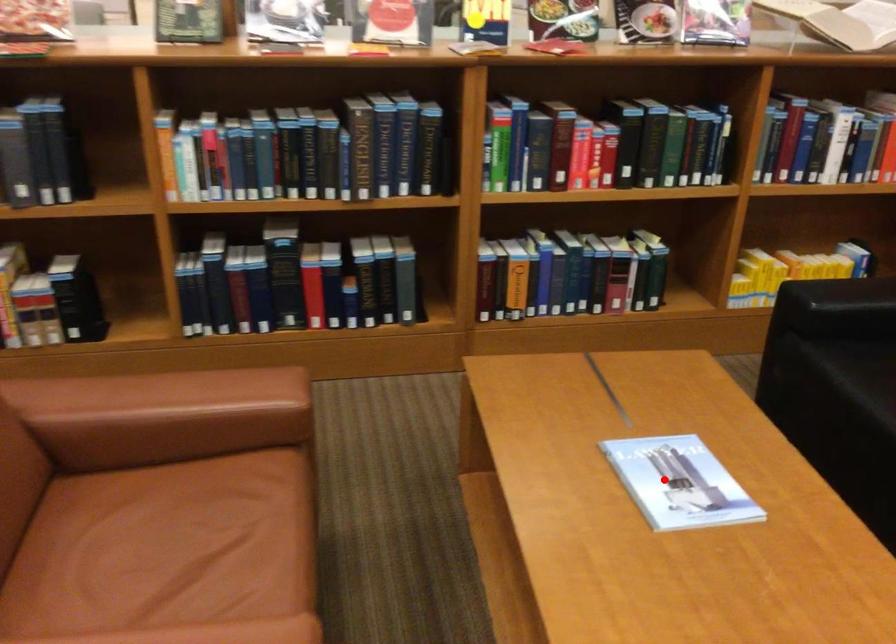
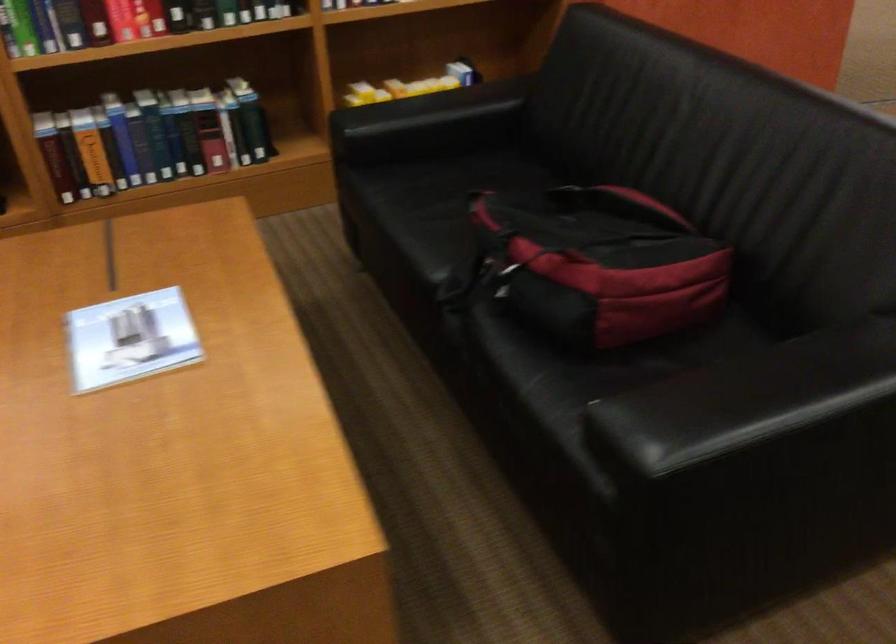
Where in the second image is the point corresponding to the highlighted location from the first image?

(131, 339)